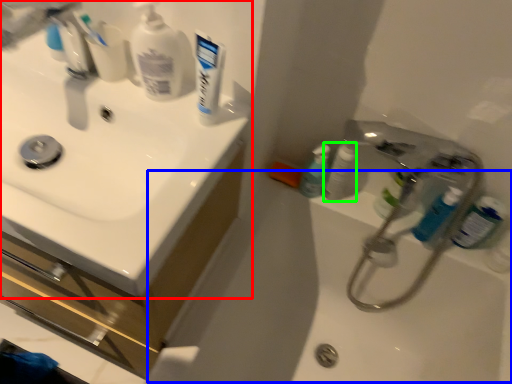
Question: Estimate the real-world distances between objects in this image. Which object is closer to sink (highlighted by a red box), bath (highlighted by a blue box) or toiletry (highlighted by a green box)?

Choices:
 (A) bath
 (B) toiletry

Answer: (A)